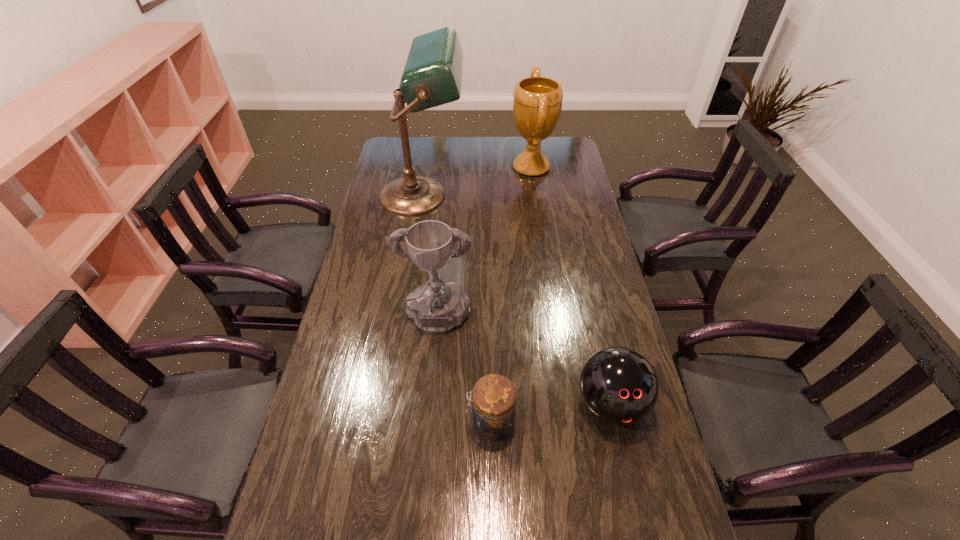
Where is `free space located on the side with emblem of the third nearest object`? The image size is (960, 540). free space located on the side with emblem of the third nearest object is located at coordinates (421, 499).

You are a GUI agent. You are given a task and a screenshot of the screen. Output one action in this format:
    pyautogui.click(x=<x>, y=<y>)
    Task: Click on the vacant space located 0.220m on the surface of the bowling ball near the finger holes
    Image resolution: width=960 pixels, height=540 pixels.
    Given the screenshot: What is the action you would take?
    pyautogui.click(x=640, y=538)

The width and height of the screenshot is (960, 540). In order to click on free location located on the lid of the jar in this screenshot , I will do `click(361, 422)`.

At what (x,y) coordinates should I click in order to perform the action: click on free location located 0.310m on the lid of the jar. Please return your answer as a coordinate pair (x, y). Looking at the image, I should click on (346, 422).

In order to click on vacant space located 0.300m on the lid of the jar in this screenshot , I will do `click(349, 422)`.

What are the coordinates of `object that is at the far edge` in the screenshot? It's located at (537, 103).

What are the coordinates of `object present at the left edge` in the screenshot? It's located at (432, 76).

Image resolution: width=960 pixels, height=540 pixels. I want to click on award that is positioned at the right edge, so click(537, 103).

At what (x,y) coordinates should I click in order to perform the action: click on bowling ball present at the right edge. Please return your answer as a coordinate pair (x, y). The image size is (960, 540). Looking at the image, I should click on (620, 386).

This screenshot has width=960, height=540. I want to click on object located in the far right corner section of the desktop, so click(537, 103).